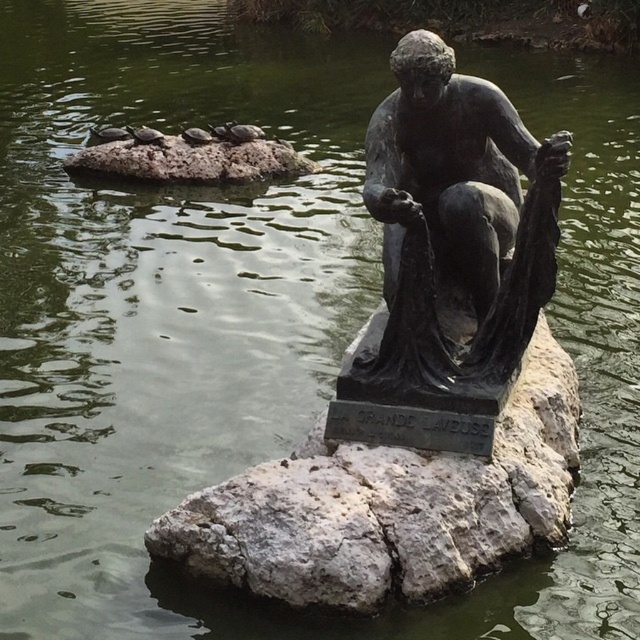
Is gray stone at center taller than gray rock at upper center?

Indeed, gray stone at center has a greater height compared to gray rock at upper center.

Does gray stone at center have a lesser width compared to gray rock at upper center?

Yes.

Between point (253, 540) and point (200, 150), which one is positioned in front?

Point (253, 540) is more forward.

Locate an element on the screen. The width and height of the screenshot is (640, 640). gray stone at center is located at coordinates (388, 506).

Measure the distance between point (368,209) and camera.

A distance of 46.62 feet exists between point (368,209) and camera.

Does point (378, 188) come farther from viewer compared to point (141, 156)?

That is False.

This screenshot has height=640, width=640. I want to click on bronze statue at center, so click(x=452, y=228).

Who is positioned more to the left, gray stone at center or bronze statue at center?

gray stone at center

Does gray stone at center appear over bronze statue at center?

Actually, gray stone at center is below bronze statue at center.

The height and width of the screenshot is (640, 640). What are the coordinates of `gray stone at center` in the screenshot? It's located at (388, 506).

I want to click on gray stone at center, so click(x=388, y=506).